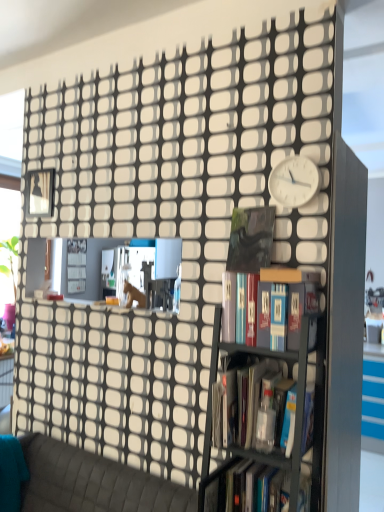
Question: Considering the relative sizes of hardcover book at center, which ranks as the 1th book in bottom-to-top order, and metallic gray bookcase at center in the image provided, is hardcover book at center, which ranks as the 1th book in bottom-to-top order, shorter than metallic gray bookcase at center?

Choices:
 (A) no
 (B) yes

Answer: (B)

Question: From a real-world perspective, is hardcover book at center, which ranks as the 1th book in bottom-to-top order, positioned under metallic gray bookcase at center based on gravity?

Choices:
 (A) yes
 (B) no

Answer: (A)

Question: Considering the relative sizes of hardcover book at center, which is counted as the third book, starting from the top, and metallic gray bookcase at center in the image provided, is hardcover book at center, which is counted as the third book, starting from the top, bigger than metallic gray bookcase at center?

Choices:
 (A) no
 (B) yes

Answer: (A)

Question: From a real-world perspective, does hardcover book at center, which ranks as the 1th book in bottom-to-top order, stand above metallic gray bookcase at center?

Choices:
 (A) no
 (B) yes

Answer: (A)

Question: Considering the relative positions of hardcover book at center, which is counted as the third book, starting from the top, and metallic gray bookcase at center in the image provided, is hardcover book at center, which is counted as the third book, starting from the top, in front of metallic gray bookcase at center?

Choices:
 (A) no
 (B) yes

Answer: (A)

Question: Considering the relative sizes of hardcover book at center, which is counted as the third book, starting from the top, and metallic gray bookcase at center in the image provided, is hardcover book at center, which is counted as the third book, starting from the top, taller than metallic gray bookcase at center?

Choices:
 (A) yes
 (B) no

Answer: (B)

Question: Does hardcover book at center, which is counted as the third book, starting from the top, have a greater height compared to translucent plastic bottle at center, acting as the second book starting from the bottom?

Choices:
 (A) yes
 (B) no

Answer: (B)

Question: Considering the relative sizes of hardcover book at center, which ranks as the 1th book in bottom-to-top order, and translucent plastic bottle at center, acting as the second book starting from the bottom, in the image provided, is hardcover book at center, which ranks as the 1th book in bottom-to-top order, smaller than translucent plastic bottle at center, acting as the second book starting from the bottom,?

Choices:
 (A) yes
 (B) no

Answer: (A)

Question: From a real-world perspective, is hardcover book at center, which is counted as the third book, starting from the top, physically above translucent plastic bottle at center, acting as the second book starting from the bottom?

Choices:
 (A) no
 (B) yes

Answer: (A)

Question: Is hardcover book at center, which is counted as the third book, starting from the top, thinner than translucent plastic bottle at center, acting as the second book starting from the bottom?

Choices:
 (A) no
 (B) yes

Answer: (A)

Question: From a real-world perspective, does hardcover book at center, which ranks as the 1th book in bottom-to-top order, sit lower than translucent plastic bottle at center, acting as the second book starting from the bottom?

Choices:
 (A) yes
 (B) no

Answer: (A)

Question: Considering the relative positions of hardcover book at center, which is counted as the third book, starting from the top, and translucent plastic bottle at center, acting as the second book starting from the bottom, in the image provided, is hardcover book at center, which is counted as the third book, starting from the top, to the left of translucent plastic bottle at center, acting as the second book starting from the bottom, from the viewer's perspective?

Choices:
 (A) yes
 (B) no

Answer: (A)

Question: Can you confirm if white plastic clock at upper right is taller than textured gray couch at lower left?

Choices:
 (A) yes
 (B) no

Answer: (B)